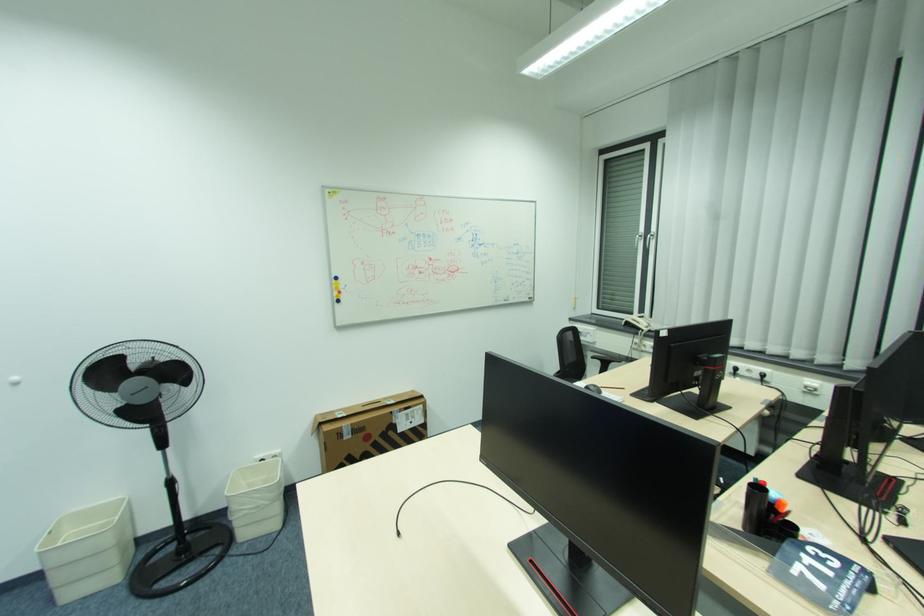
The location [336,283] corresponds to which object?

This point indicates the blue whiteboard magnet.